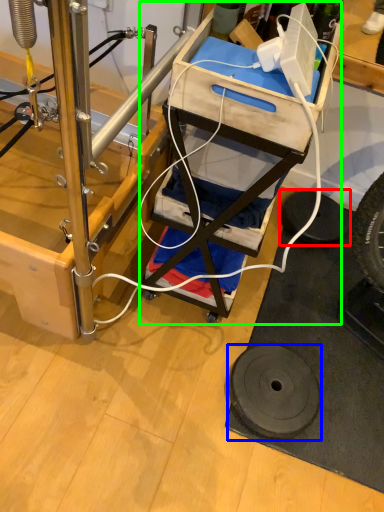
Question: Which object is positioned farthest from tire (highlighted by a red box)? Select from wheel (highlighted by a blue box) and furniture (highlighted by a green box).

Choices:
 (A) wheel
 (B) furniture

Answer: (B)